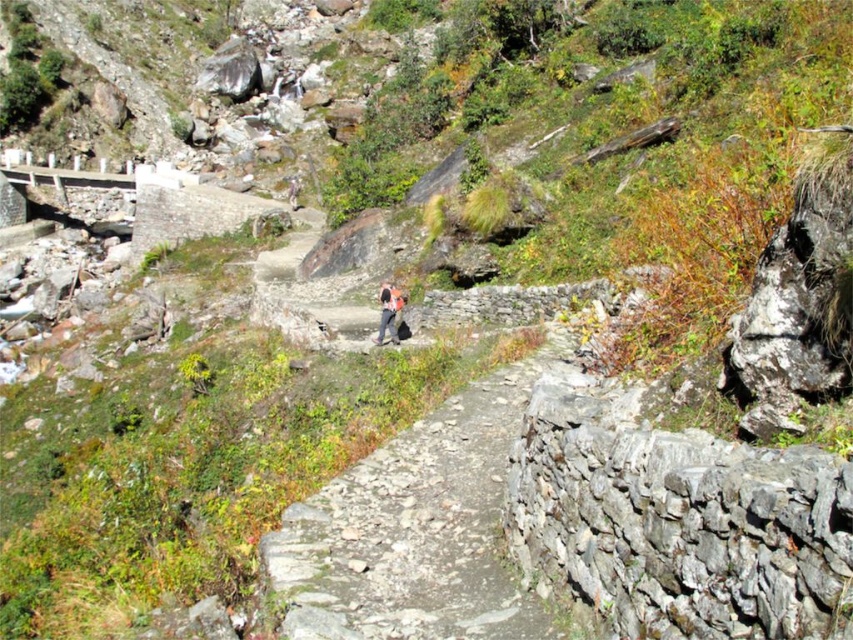
You are hiking along the gray stone path at center and see the camouflage fabric backpack at center nearby. From your perspective, which object is positioned to the right?

The gray stone path at center is to the right of the camouflage fabric backpack at center, so the gray stone path at center is positioned to the right.

You are a hiker carrying a camouflage fabric backpack at center and want to walk along the gray stone path at center. Can your backpack fit on the path without going off the sides?

The gray stone path at center is bigger than the camouflage fabric backpack at center, so yes, the backpack can fit on the path without going off the sides.

You are a hiker carrying a camouflage fabric backpack at center and want to walk along the gray stone path at center. Can your backpack fit through the path without needing to turn sideways?

The gray stone path at center is wider than the camouflage fabric backpack at center, so the backpack can fit through the path without needing to turn sideways.